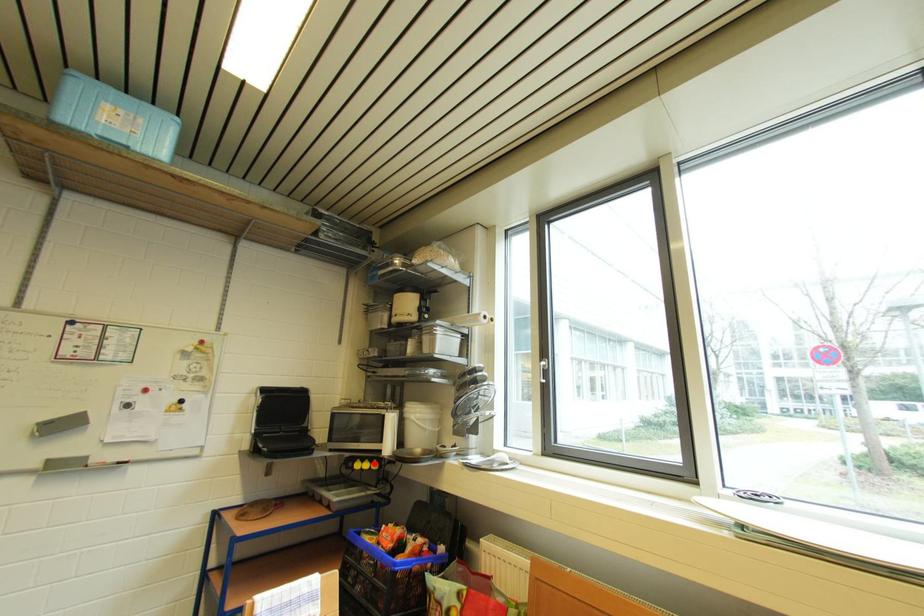
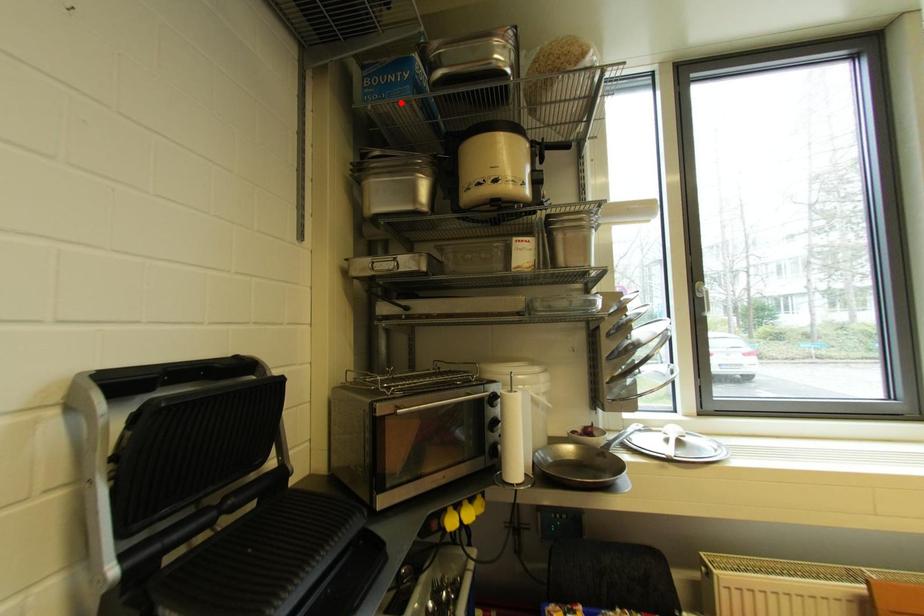
I am providing you with two images of the same scene from different viewpoints. A red point is marked on the first image and another point is marked on the second image. Is the red point in image1 aligned with the point shown in image2?

No